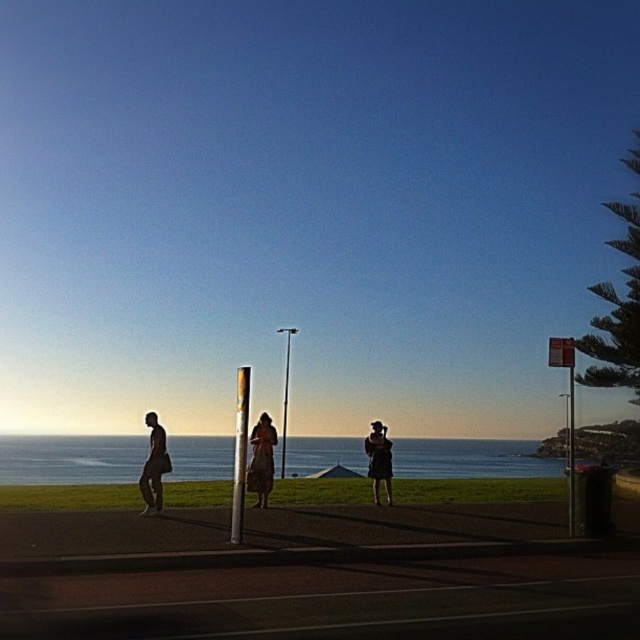
Is gold metallic pole at center behind dark blue dress at center?

That is False.

Measure the distance from gold metallic pole at center to dark blue dress at center.

gold metallic pole at center is 15.93 feet from dark blue dress at center.

Describe the element at coordinates (240, 452) in the screenshot. I see `gold metallic pole at center` at that location.

The image size is (640, 640). In order to click on gold metallic pole at center in this screenshot , I will do `click(240, 452)`.

Who is more forward, (147, 474) or (289, 344)?

Point (147, 474) is in front.

Can you confirm if dark gray fabric shirt at left is shorter than metallic pole at center?

Yes.

Which is behind, point (141, 483) or point (284, 465)?

Positioned behind is point (284, 465).

Locate an element on the screen. dark gray fabric shirt at left is located at coordinates (154, 467).

Consider the image. Between blue water at lower center and metallic pole at center, which one is positioned higher?

metallic pole at center is above.

Is point (310, 452) in front of point (288, 368)?

Yes, point (310, 452) is closer to viewer.

The width and height of the screenshot is (640, 640). I want to click on blue water at lower center, so click(x=70, y=460).